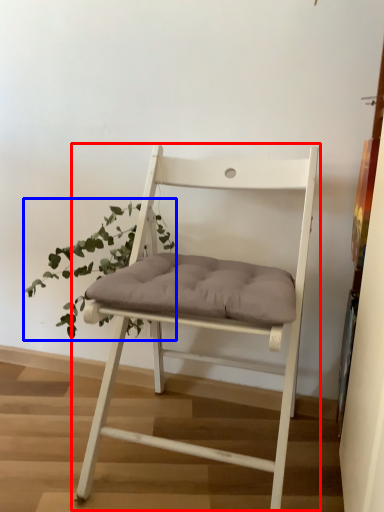
Question: Which of the following is the farthest to the observer, chair (highlighted by a red box) or houseplant (highlighted by a blue box)?

Choices:
 (A) chair
 (B) houseplant

Answer: (B)